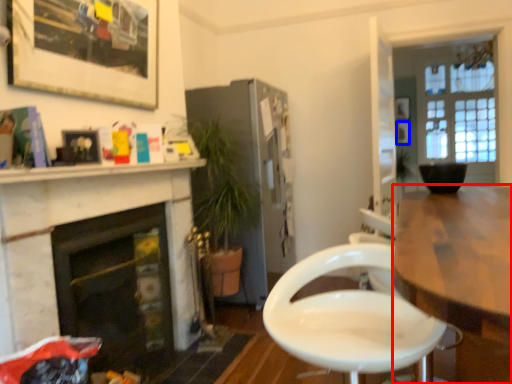
Question: Which object appears closest to the camera in this image, kitchen & dining room table (highlighted by a red box) or picture frame (highlighted by a blue box)?

Choices:
 (A) kitchen & dining room table
 (B) picture frame

Answer: (A)